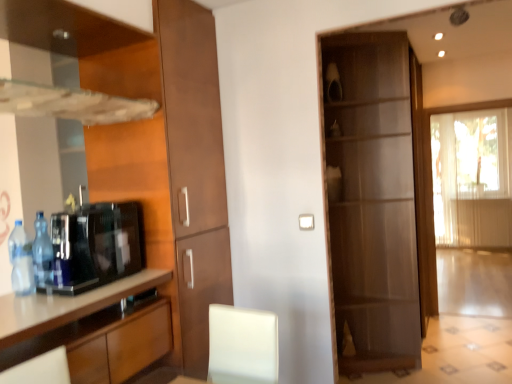
How much space does blue plastic bottle at left, marked as the second bottle in a back-to-front arrangement, occupy vertically?

blue plastic bottle at left, marked as the second bottle in a back-to-front arrangement, is 11.89 inches in height.

In order to face blue plastic bottle at left, which is the first bottle in front-to-back order, should I rotate leftwards or rightwards?

Rotate left and turn 28.581 degrees.

The width and height of the screenshot is (512, 384). What are the coordinates of `matte brown cabinet at center` in the screenshot? It's located at (375, 200).

Find the location of a particular element. The height and width of the screenshot is (384, 512). blue plastic bottle at left, the second bottle when ordered from front to back is located at coordinates (42, 253).

Where is `blue plastic bottle at left, marked as the second bottle in a back-to-front arrangement`? blue plastic bottle at left, marked as the second bottle in a back-to-front arrangement is located at coordinates (21, 261).

Which object is thinner, translucent fabric curtain at right or brown wood cabinet at left, arranged as the second cabinetry when viewed from the back?

With smaller width is translucent fabric curtain at right.

Starting from the translucent fabric curtain at right, which cabinetry is the 2nd one to the left? Please provide its 2D coordinates.

[(90, 329)]

Can you confirm if translucent fabric curtain at right is taller than brown wood cabinet at left, arranged as the second cabinetry when viewed from the back?

Correct, translucent fabric curtain at right is much taller as brown wood cabinet at left, arranged as the second cabinetry when viewed from the back.

Is translucent fabric curtain at right oriented towards brown wood cabinet at left, positioned as the first cabinetry in front-to-back order?

Yes.

Considering the points (19, 266) and (98, 316), which point is in front, point (19, 266) or point (98, 316)?

The point (98, 316) is in front.

Which of these two, blue plastic bottle at left, marked as the second bottle in a back-to-front arrangement, or brown wood cabinet at left, arranged as the second cabinetry when viewed from the back, is wider?

brown wood cabinet at left, arranged as the second cabinetry when viewed from the back.

Which of these two, blue plastic bottle at left, which is the first bottle in front-to-back order, or brown wood cabinet at left, positioned as the first cabinetry in front-to-back order, stands taller?

Standing taller between the two is brown wood cabinet at left, positioned as the first cabinetry in front-to-back order.

In the scene shown: Is there a large distance between blue plastic bottle at left, which is the first bottle in front-to-back order, and brown wood cabinet at left, arranged as the second cabinetry when viewed from the back?

No, blue plastic bottle at left, which is the first bottle in front-to-back order, is not far away from brown wood cabinet at left, arranged as the second cabinetry when viewed from the back.

From the image's perspective, which one is positioned higher, blue plastic bottle at left, which is counted as the first bottle, starting from the back, or matte brown cabinet at center?

matte brown cabinet at center, from the image's perspective.

Between blue plastic bottle at left, the second bottle when ordered from front to back, and matte brown cabinet at center, which one has more height?

Standing taller between the two is matte brown cabinet at center.

Based on the photo, which object is positioned more to the right, blue plastic bottle at left, the second bottle when ordered from front to back, or matte brown cabinet at center?

matte brown cabinet at center is more to the right.

Which is in front, point (44, 244) or point (340, 346)?

The point (44, 244) is closer to the camera.

Is matte brown cabinet at left, the second cabinetry from the front, wider or thinner than blue plastic bottle at left, which is counted as the first bottle, starting from the back?

Considering their sizes, matte brown cabinet at left, the second cabinetry from the front, looks broader than blue plastic bottle at left, which is counted as the first bottle, starting from the back.

Considering the relative positions of matte brown cabinet at left, the second cabinetry from the front, and blue plastic bottle at left, the second bottle when ordered from front to back, in the image provided, is matte brown cabinet at left, the second cabinetry from the front, behind blue plastic bottle at left, the second bottle when ordered from front to back,?

Yes, the depth of matte brown cabinet at left, the second cabinetry from the front, is greater than that of blue plastic bottle at left, the second bottle when ordered from front to back.

From their relative heights in the image, would you say matte brown cabinet at left, which is counted as the first cabinetry, starting from the back, is taller or shorter than blue plastic bottle at left, the second bottle when ordered from front to back?

→ Clearly, matte brown cabinet at left, which is counted as the first cabinetry, starting from the back, is taller compared to blue plastic bottle at left, the second bottle when ordered from front to back.

Considering the relative positions of blue plastic bottle at left, marked as the second bottle in a back-to-front arrangement, and translucent fabric curtain at right in the image provided, is blue plastic bottle at left, marked as the second bottle in a back-to-front arrangement, to the right of translucent fabric curtain at right from the viewer's perspective?

In fact, blue plastic bottle at left, marked as the second bottle in a back-to-front arrangement, is to the left of translucent fabric curtain at right.

Considering the sizes of objects blue plastic bottle at left, marked as the second bottle in a back-to-front arrangement, and translucent fabric curtain at right in the image provided, who is shorter, blue plastic bottle at left, marked as the second bottle in a back-to-front arrangement, or translucent fabric curtain at right?

blue plastic bottle at left, marked as the second bottle in a back-to-front arrangement, is shorter.

Considering the sizes of blue plastic bottle at left, marked as the second bottle in a back-to-front arrangement, and translucent fabric curtain at right in the image, is blue plastic bottle at left, marked as the second bottle in a back-to-front arrangement, wider or thinner than translucent fabric curtain at right?

Considering their sizes, blue plastic bottle at left, marked as the second bottle in a back-to-front arrangement, looks slimmer than translucent fabric curtain at right.

Is blue plastic bottle at left, marked as the second bottle in a back-to-front arrangement, in front of translucent fabric curtain at right?

Yes.

From a real-world perspective, which object rests below the other?

blue plastic bottle at left, which is the first bottle in front-to-back order, from a real-world perspective.

Starting from the black glossy coffee machine at lower left, which bottle is the 1st one behind? Please provide its 2D coordinates.

[(21, 261)]

Is black glossy coffee machine at lower left facing towards blue plastic bottle at left, marked as the second bottle in a back-to-front arrangement?

Yes, black glossy coffee machine at lower left faces towards blue plastic bottle at left, marked as the second bottle in a back-to-front arrangement.

Considering the sizes of black glossy coffee machine at lower left and blue plastic bottle at left, marked as the second bottle in a back-to-front arrangement, in the image, is black glossy coffee machine at lower left taller or shorter than blue plastic bottle at left, marked as the second bottle in a back-to-front arrangement,?

Clearly, black glossy coffee machine at lower left is taller compared to blue plastic bottle at left, marked as the second bottle in a back-to-front arrangement.

Is translucent fabric curtain at right not inside blue plastic bottle at left, which is counted as the first bottle, starting from the back?

That's correct, translucent fabric curtain at right is outside of blue plastic bottle at left, which is counted as the first bottle, starting from the back.

Is translucent fabric curtain at right directly adjacent to blue plastic bottle at left, the second bottle when ordered from front to back?

No, translucent fabric curtain at right is not in contact with blue plastic bottle at left, the second bottle when ordered from front to back.

In the scene shown: Between translucent fabric curtain at right and blue plastic bottle at left, which is counted as the first bottle, starting from the back, which one appears on the right side from the viewer's perspective?

translucent fabric curtain at right.

From a real-world perspective, is translucent fabric curtain at right below blue plastic bottle at left, which is counted as the first bottle, starting from the back?

Yes, from a real-world perspective, translucent fabric curtain at right is below blue plastic bottle at left, which is counted as the first bottle, starting from the back.

Identify the location of cabinetry located underneath the translucent fabric curtain at right (from a real-world perspective). This screenshot has width=512, height=384. (90, 329).

Locate an element on the screen. This screenshot has height=384, width=512. the 2nd bottle to the left of the brown wood cabinet at left, positioned as the first cabinetry in front-to-back order, counting from the anchor's position is located at coordinates (21, 261).

Which object lies nearer to the anchor point matte brown cabinet at left, which is counted as the first cabinetry, starting from the back, translucent fabric curtain at right or blue plastic bottle at left, the second bottle when ordered from front to back?

blue plastic bottle at left, the second bottle when ordered from front to back, lies closer to matte brown cabinet at left, which is counted as the first cabinetry, starting from the back, than the other object.

Estimate the real-world distances between objects in this image. Which object is further from blue plastic bottle at left, the second bottle when ordered from front to back, brown wood cabinet at left, arranged as the second cabinetry when viewed from the back, or matte brown cabinet at left, which is counted as the first cabinetry, starting from the back?

matte brown cabinet at left, which is counted as the first cabinetry, starting from the back, is positioned further to the anchor blue plastic bottle at left, the second bottle when ordered from front to back.

Based on their spatial positions, is translucent fabric curtain at right or matte brown cabinet at left, the second cabinetry from the front, closer to black glossy coffee machine at lower left?

Based on the image, matte brown cabinet at left, the second cabinetry from the front, appears to be nearer to black glossy coffee machine at lower left.

Considering their positions, is brown wood cabinet at left, arranged as the second cabinetry when viewed from the back, positioned closer to black glossy coffee machine at lower left than matte brown cabinet at center?

brown wood cabinet at left, arranged as the second cabinetry when viewed from the back, lies closer to black glossy coffee machine at lower left than the other object.

Which object lies nearer to the anchor point translucent fabric curtain at right, brown wood cabinet at left, arranged as the second cabinetry when viewed from the back, or matte brown cabinet at center?

The object closer to translucent fabric curtain at right is matte brown cabinet at center.

When comparing their distances from matte brown cabinet at center, does blue plastic bottle at left, which is counted as the first bottle, starting from the back, or matte brown cabinet at left, the second cabinetry from the front, seem further?

blue plastic bottle at left, which is counted as the first bottle, starting from the back, is positioned further to the anchor matte brown cabinet at center.

From the image, which object appears to be nearer to blue plastic bottle at left, the second bottle when ordered from front to back, matte brown cabinet at left, the second cabinetry from the front, or translucent fabric curtain at right?

matte brown cabinet at left, the second cabinetry from the front, is closer to blue plastic bottle at left, the second bottle when ordered from front to back.

When comparing their distances from blue plastic bottle at left, marked as the second bottle in a back-to-front arrangement, does matte brown cabinet at left, the second cabinetry from the front, or brown wood cabinet at left, arranged as the second cabinetry when viewed from the back, seem closer?

brown wood cabinet at left, arranged as the second cabinetry when viewed from the back.

Locate an element on the screen. This screenshot has width=512, height=384. bottle positioned between brown wood cabinet at left, positioned as the first cabinetry in front-to-back order, and blue plastic bottle at left, which is counted as the first bottle, starting from the back, from near to far is located at coordinates (21, 261).

Locate an element on the screen. This screenshot has height=384, width=512. door between brown wood cabinet at left, positioned as the first cabinetry in front-to-back order, and translucent fabric curtain at right in the front-back direction is located at coordinates (375, 200).

This screenshot has width=512, height=384. I want to click on bottle located between black glossy coffee machine at lower left and blue plastic bottle at left, which is counted as the first bottle, starting from the back, in the depth direction, so click(x=21, y=261).

At what (x,y) coordinates should I click in order to perform the action: click on bottle between blue plastic bottle at left, which is the first bottle in front-to-back order, and matte brown cabinet at left, which is counted as the first cabinetry, starting from the back, in the horizontal direction. Please return your answer as a coordinate pair (x, y). Looking at the image, I should click on (42, 253).